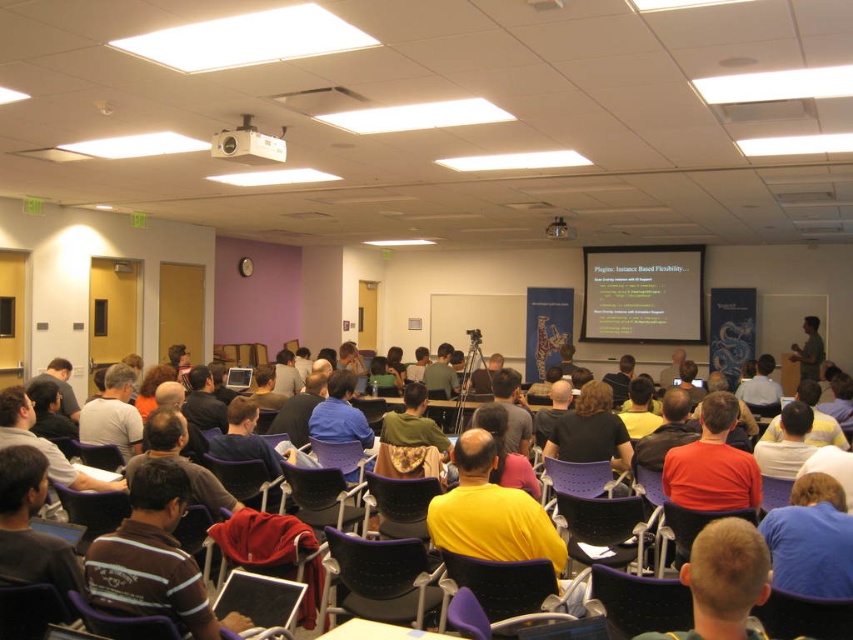
Question: Which point appears closest to the camera in this image?

Choices:
 (A) (834, 637)
 (B) (599, 300)

Answer: (A)

Question: Which point appears closest to the camera in this image?

Choices:
 (A) (134, 424)
 (B) (625, 333)
 (C) (682, 624)

Answer: (C)

Question: Which is nearer to the white matte projection screen at upper center?

Choices:
 (A) white plastic projector at upper center
 (B) matte orange shirt at center
 (C) matte black laptop at center
 (D) dark gray shirt at center

Answer: (B)

Question: Is striped cotton shirt at lower left below matte black laptop at center?

Choices:
 (A) no
 (B) yes

Answer: (A)

Question: Does matte orange shirt at center appear over dark gray shirt at center?

Choices:
 (A) yes
 (B) no

Answer: (B)

Question: Is white matte projection screen at upper center above matte orange shirt at center?

Choices:
 (A) no
 (B) yes

Answer: (B)